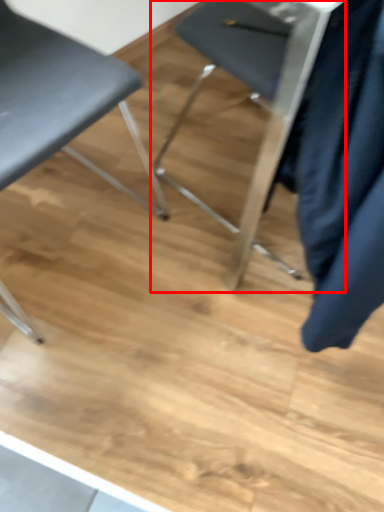
Question: From the image, what is the correct spatial relationship of chair (annotated by the red box) in relation to chair?

Choices:
 (A) right
 (B) left

Answer: (A)